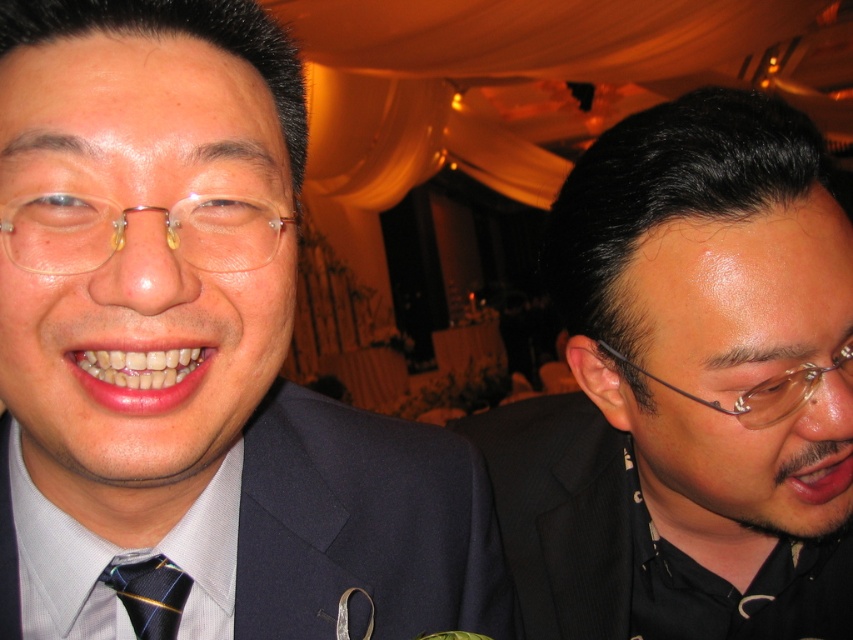
Locate an element on the screen. black pinstripe suit at right is located at coordinates (627, 540).

Is point (595, 540) farther from camera compared to point (260, 260)?

Yes, point (595, 540) is behind point (260, 260).

Locate an element on the screen. The width and height of the screenshot is (853, 640). black pinstripe suit at right is located at coordinates (627, 540).

Who is more forward, (x=154, y=605) or (x=845, y=369)?

Point (x=154, y=605)

Between striped silk tie at left and transparent plastic glasses at right, which one has more height?

transparent plastic glasses at right is taller.

Identify the location of striped silk tie at left. (149, 595).

Locate an element on the screen. The height and width of the screenshot is (640, 853). striped silk tie at left is located at coordinates 149,595.

Between black pinstripe suit at right and striped silk tie at left, which one appears on the right side from the viewer's perspective?

From the viewer's perspective, black pinstripe suit at right appears more on the right side.

Is black pinstripe suit at right positioned at the back of striped silk tie at left?

Yes.

In order to click on black pinstripe suit at right in this screenshot , I will do [x=627, y=540].

I want to click on black pinstripe suit at right, so click(x=627, y=540).